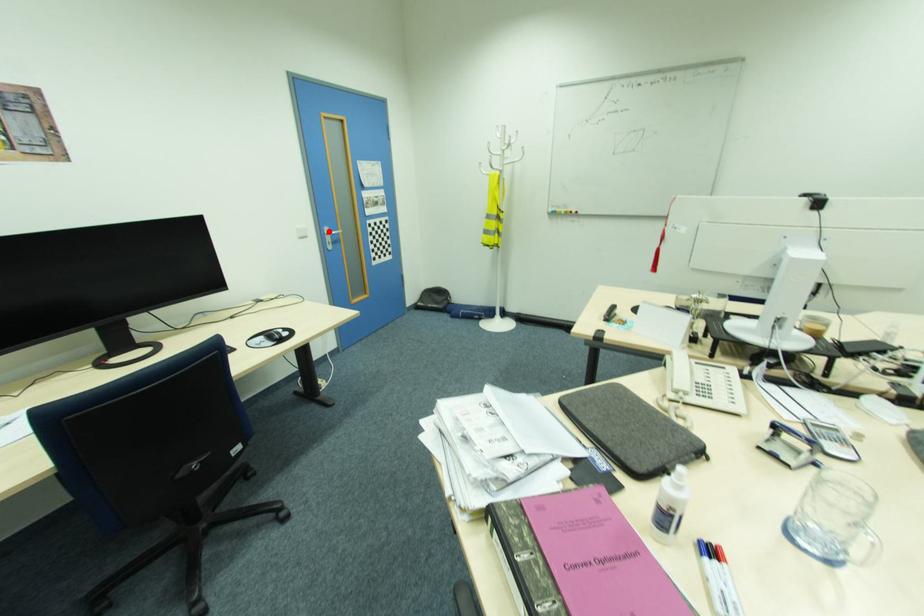
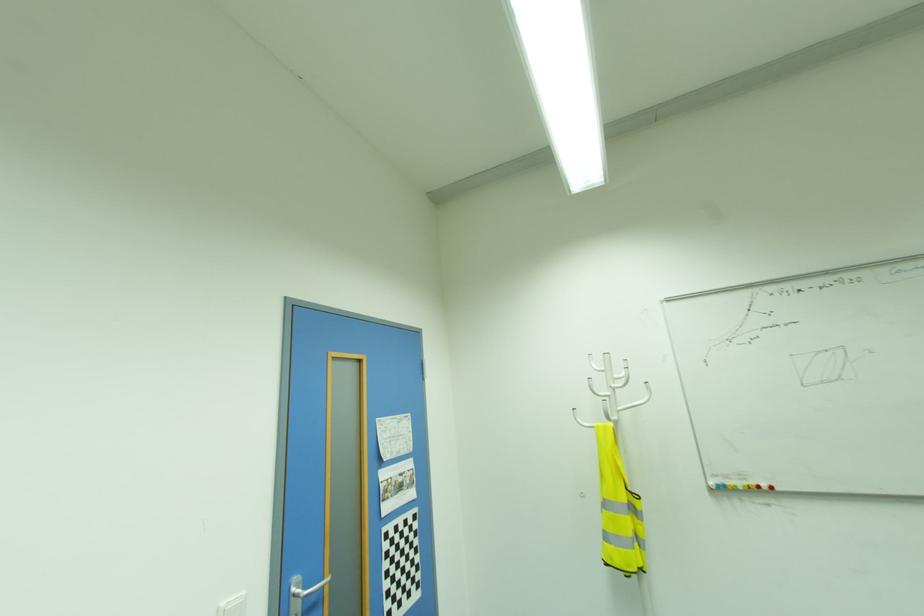
Locate, in the second image, the point that corresponds to the highlighted location in the first image.

(296, 590)